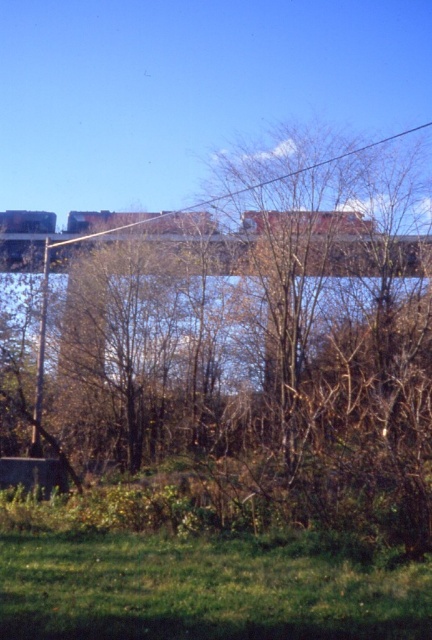
Is brown leafy tree at center above green grass at lower center?

Correct, brown leafy tree at center is located above green grass at lower center.

Find the location of `brown leafy tree at center`. brown leafy tree at center is located at coordinates (244, 365).

You are a GUI agent. You are given a task and a screenshot of the screen. Output one action in this format:
    pyautogui.click(x=<x>, y=<y>)
    Task: Click on the brown leafy tree at center
    The image size is (432, 640).
    Given the screenshot: What is the action you would take?
    pyautogui.click(x=244, y=365)

Image resolution: width=432 pixels, height=640 pixels. What are the coordinates of `brown leafy tree at center` in the screenshot? It's located at (244, 365).

How much distance is there between brown leafy tree at center and metallic wire at upper center?

They are 2.58 meters apart.

Can you confirm if brown leafy tree at center is bigger than metallic wire at upper center?

Yes, brown leafy tree at center is bigger than metallic wire at upper center.

Locate an element on the screen. The image size is (432, 640). brown leafy tree at center is located at coordinates (244, 365).

The image size is (432, 640). What are the coordinates of `brown leafy tree at center` in the screenshot? It's located at (244, 365).

Is green grass at lower center to the right of metallic wire at upper center from the viewer's perspective?

Yes, green grass at lower center is to the right of metallic wire at upper center.

Where is `green grass at lower center`? The image size is (432, 640). green grass at lower center is located at coordinates (199, 584).

Locate an element on the screen. The width and height of the screenshot is (432, 640). green grass at lower center is located at coordinates (199, 584).